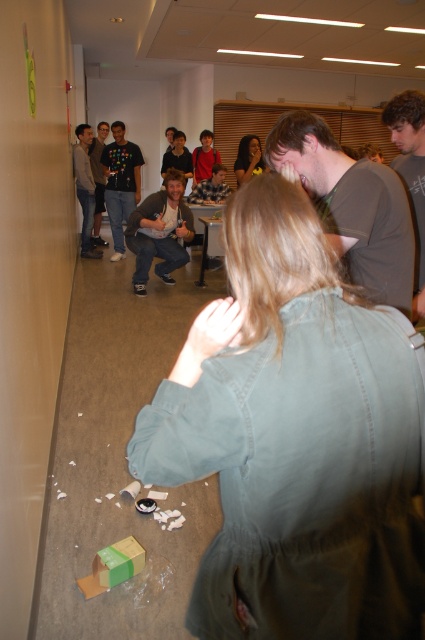
Question: Does gray cotton shirt at upper right have a smaller size compared to dark gray hoodie at left?

Choices:
 (A) no
 (B) yes

Answer: (B)

Question: Among these points, which one is farthest from the camera?

Choices:
 (A) (309, 163)
 (B) (272, 628)

Answer: (A)

Question: Among these points, which one is nearest to the camera?

Choices:
 (A) (198, 173)
 (B) (223, 170)

Answer: (B)

Question: Does matte gray hoodie at center appear on the right side of matte black shirt at center?

Choices:
 (A) yes
 (B) no

Answer: (A)

Question: Estimate the real-world distances between objects in this image. Which object is closer to the matte black t-shirt at center?

Choices:
 (A) matte gray hoodie at center
 (B) dark gray hoodie at center
 (C) gray cotton shirt at upper right
 (D) matte black hair at center

Answer: (B)

Question: Is matte black t-shirt at center above dark gray hoodie at left?

Choices:
 (A) no
 (B) yes

Answer: (A)